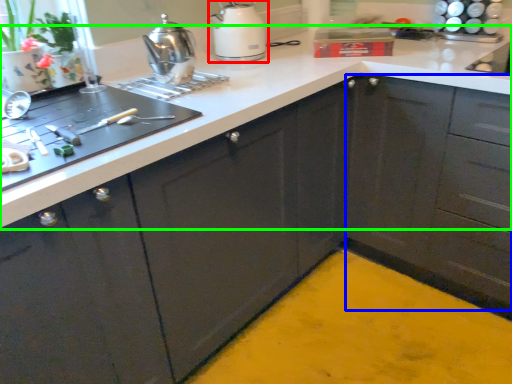
Question: Which is farther away from kitchen appliance (highlighted by a red box)? cabinetry (highlighted by a blue box) or countertop (highlighted by a green box)?

Choices:
 (A) cabinetry
 (B) countertop

Answer: (A)